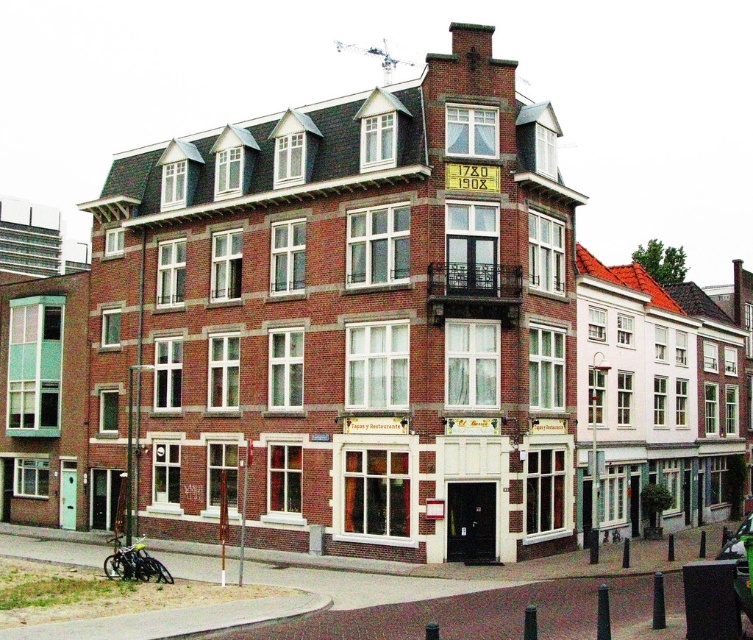
Between point (162, 573) and point (747, 531), which one is positioned behind?

Positioned behind is point (747, 531).

The image size is (753, 640). Identify the location of metallic silver motorcycle at lower left. (133, 563).

Is brick building at center taller than metallic silver car at center?

Yes.

Can you confirm if brick building at center is smaller than metallic silver car at center?

Incorrect, brick building at center is not smaller in size than metallic silver car at center.

Which is in front, point (276, 116) or point (732, 540)?

Point (732, 540) is in front.

Locate an element on the screen. The height and width of the screenshot is (640, 753). brick building at center is located at coordinates (343, 323).

Can you confirm if brick building at center is positioned to the left of metallic silver motorcycle at lower left?

Incorrect, brick building at center is not on the left side of metallic silver motorcycle at lower left.

Does point (130, 387) lie behind point (120, 560)?

That is True.

This screenshot has width=753, height=640. I want to click on brick building at center, so click(x=343, y=323).